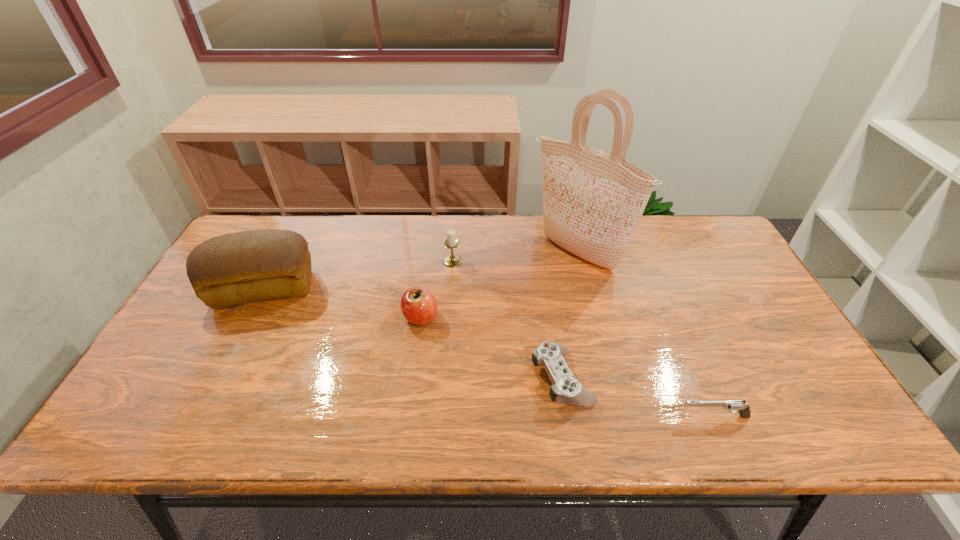
Identify the location of free location at the far edge of the desktop. (385, 256).

Locate an element on the screen. The height and width of the screenshot is (540, 960). free spot at the near edge of the desktop is located at coordinates (248, 436).

Where is `vacant space at the left edge of the desktop`? vacant space at the left edge of the desktop is located at coordinates (237, 325).

Where is `vacant area at the far left corner of the desktop`? This screenshot has height=540, width=960. vacant area at the far left corner of the desktop is located at coordinates (291, 216).

Identify the location of free space at the far right corner of the desktop. (726, 260).

This screenshot has width=960, height=540. In order to click on vacant space that's between the nearest object and the bread in this screenshot , I will do `click(490, 353)`.

You are a GUI agent. You are given a task and a screenshot of the screen. Output one action in this format:
    pyautogui.click(x=<x>, y=<y>)
    Task: Click on the empty space that is in between the leftmost object and the candle holder
    This screenshot has width=960, height=540.
    Given the screenshot: What is the action you would take?
    pyautogui.click(x=358, y=275)

Where is `vacant space in between the nearest object and the fourth shortest object`? This screenshot has width=960, height=540. vacant space in between the nearest object and the fourth shortest object is located at coordinates (584, 339).

Locate an element on the screen. The height and width of the screenshot is (540, 960). free space that is in between the tallest object and the fifth shortest object is located at coordinates (420, 271).

Find the location of `vacant space that is in between the tallest object and the pistol`. vacant space that is in between the tallest object and the pistol is located at coordinates (645, 335).